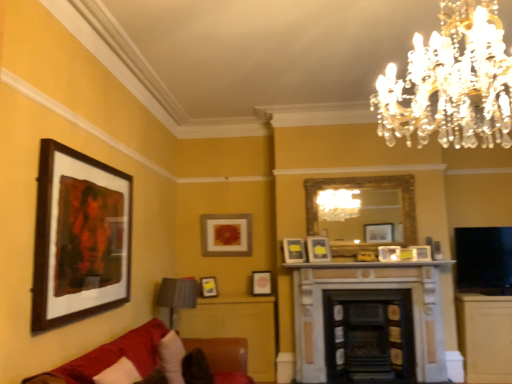
Question: Would you say velvet red couch at lower left is a long distance from matte gold picture frame at center, the third picture frame viewed from the left?

Choices:
 (A) no
 (B) yes

Answer: (B)

Question: Considering the relative sizes of velvet red couch at lower left and matte gold picture frame at center, which appears as the 8th picture frame when viewed from the front, in the image provided, is velvet red couch at lower left smaller than matte gold picture frame at center, which appears as the 8th picture frame when viewed from the front,?

Choices:
 (A) no
 (B) yes

Answer: (A)

Question: Is the surface of velvet red couch at lower left in direct contact with matte gold picture frame at center, marked as the 1th picture frame in a back-to-front arrangement?

Choices:
 (A) no
 (B) yes

Answer: (A)

Question: From a real-world perspective, is velvet red couch at lower left on top of matte gold picture frame at center, marked as the 1th picture frame in a back-to-front arrangement?

Choices:
 (A) no
 (B) yes

Answer: (A)

Question: Does velvet red couch at lower left have a lesser height compared to matte gold picture frame at center, marked as the 1th picture frame in a back-to-front arrangement?

Choices:
 (A) no
 (B) yes

Answer: (A)

Question: From the image's perspective, relative to matte black picture frame at center, which ranks as the 4th picture frame in front-to-back order, is matte wooden picture frame at center, positioned as the fourth picture frame in left-to-right order, above or below?

Choices:
 (A) below
 (B) above

Answer: (A)

Question: In the image, is matte wooden picture frame at center, which is the 7th picture frame in front-to-back order, on the left side or the right side of matte black picture frame at center, which ranks as the 4th picture frame in front-to-back order?

Choices:
 (A) left
 (B) right

Answer: (A)

Question: Is point (268, 294) positioned closer to the camera than point (391, 256)?

Choices:
 (A) closer
 (B) farther

Answer: (B)

Question: Which is correct: matte wooden picture frame at center, positioned as the fourth picture frame in left-to-right order, is inside matte black picture frame at center, which ranks as the 5th picture frame in back-to-front order, or outside of it?

Choices:
 (A) outside
 (B) inside

Answer: (A)

Question: Is point (364, 299) closer or farther from the camera than point (198, 357)?

Choices:
 (A) closer
 (B) farther

Answer: (B)

Question: Is dark brown wood fireplace at center, acting as the first fireplace starting from the right, bigger or smaller than brown fuzzy pillow at lower left, the second pillow positioned from the left?

Choices:
 (A) big
 (B) small

Answer: (A)

Question: From the image's perspective, is dark brown wood fireplace at center, acting as the first fireplace starting from the right, above or below brown fuzzy pillow at lower left, the 1th pillow in the right-to-left sequence?

Choices:
 (A) above
 (B) below

Answer: (B)

Question: Considering their positions, is dark brown wood fireplace at center, acting as the first fireplace starting from the right, located in front of or behind brown fuzzy pillow at lower left, the second pillow positioned from the left?

Choices:
 (A) behind
 (B) front

Answer: (A)

Question: From the image's perspective, is matte wooden picture frame at center, which is the 7th picture frame in front-to-back order, located above or below wooden framed artwork at left, positioned as the eighth picture frame in back-to-front order?

Choices:
 (A) above
 (B) below

Answer: (B)

Question: Is matte wooden picture frame at center, the second picture frame viewed from the back, spatially inside wooden framed artwork at left, marked as the 8th picture frame in a right-to-left arrangement, or outside of it?

Choices:
 (A) outside
 (B) inside

Answer: (A)